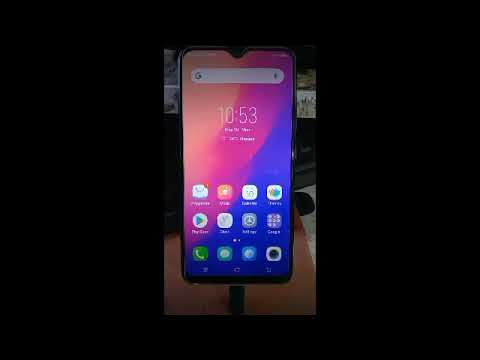
The image size is (480, 360). I want to click on led, so click(x=244, y=174).